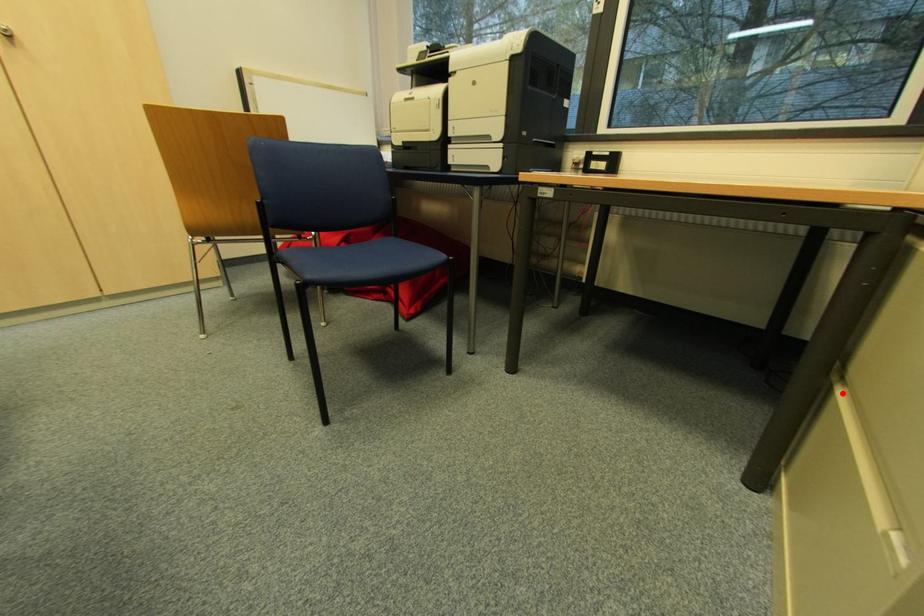
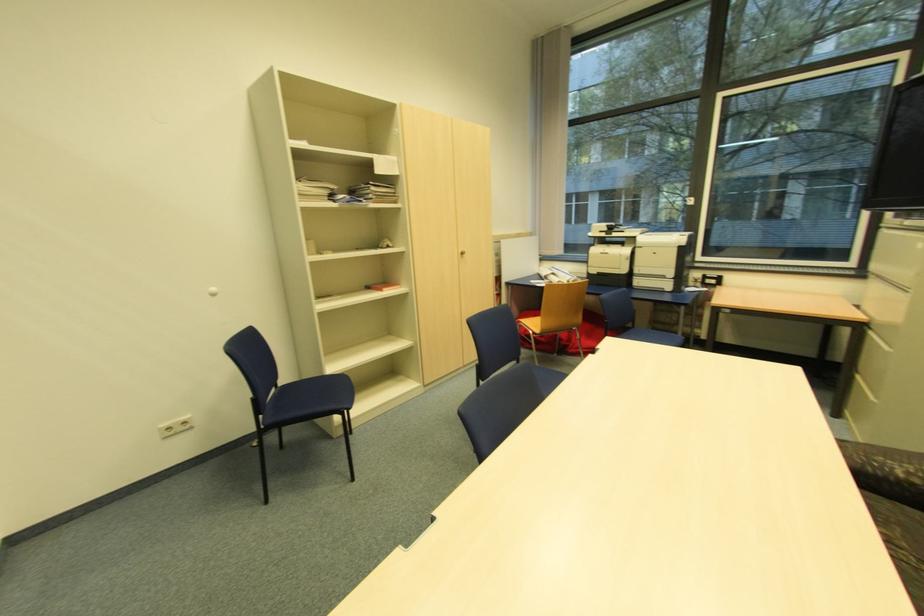
In the second image, find the point that corresponds to the highlighted location in the first image.

(860, 377)